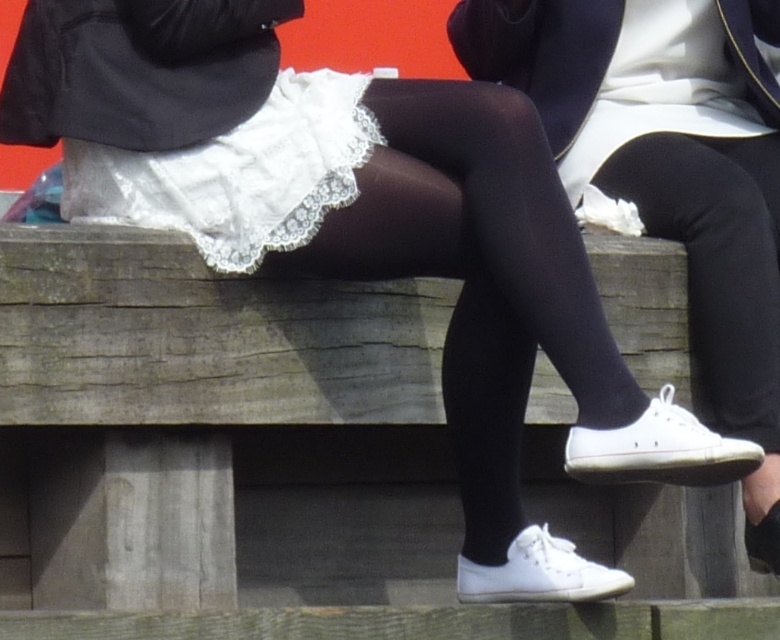
Who is more distant from viewer, (715, 20) or (158, 188)?

The point (715, 20) is more distant.

Between white matte sneakers at lower center and white lace skirt at center, which one appears on the left side from the viewer's perspective?

white lace skirt at center is more to the left.

Where is `white matte sneakers at lower center`? This screenshot has height=640, width=780. white matte sneakers at lower center is located at coordinates (672, 170).

Is black tights at center positioned at the back of white lace skirt at center?

That is False.

Is point (546, 193) positioned before point (236, 157)?

Yes, point (546, 193) is in front of point (236, 157).

Is point (512, 428) positioned in front of point (250, 154)?

No, (512, 428) is further to viewer.

Find the location of a particular element. The height and width of the screenshot is (640, 780). black tights at center is located at coordinates (477, 275).

Is black tights at center above black matte leggings at right?

No, black tights at center is not above black matte leggings at right.

Which of these two, black tights at center or black matte leggings at right, stands shorter?

Answer: Standing shorter between the two is black matte leggings at right.

Who is more distant from viewer, (481, 204) or (771, 225)?

Positioned behind is point (771, 225).

Where is `black tights at center`? The height and width of the screenshot is (640, 780). black tights at center is located at coordinates click(477, 275).